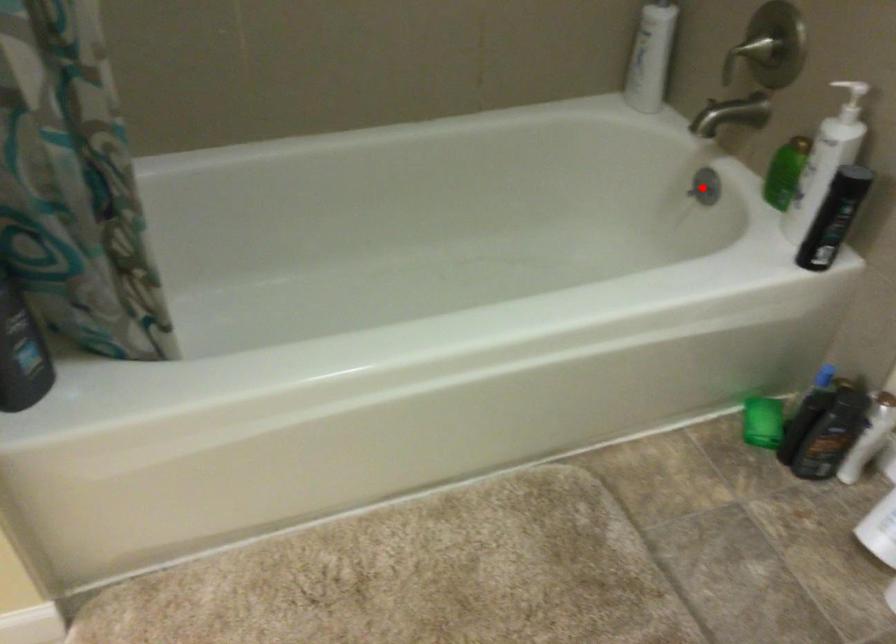
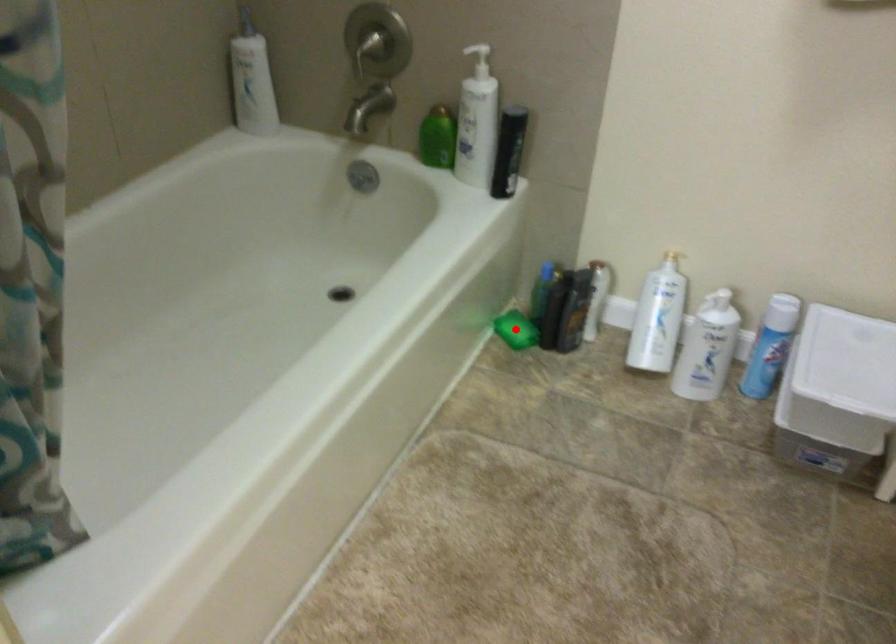
I am providing you with two images of the same scene from different viewpoints. A red point is marked on the first image and another point is marked on the second image. Is the marked point in image1 the same physical position as the marked point in image2?

No